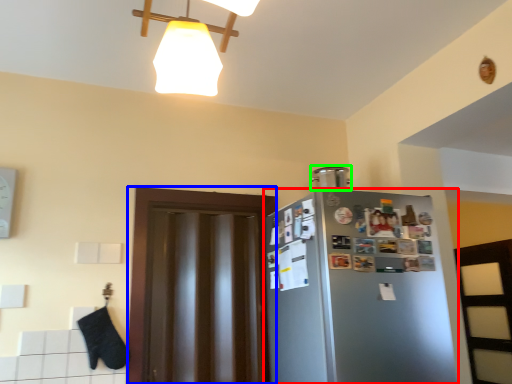
Question: Based on their relative distances, which object is farther from refrigerator (highlighted by a red box)? Choose from glass door (highlighted by a blue box) and appliance (highlighted by a green box).

Choices:
 (A) glass door
 (B) appliance

Answer: (B)